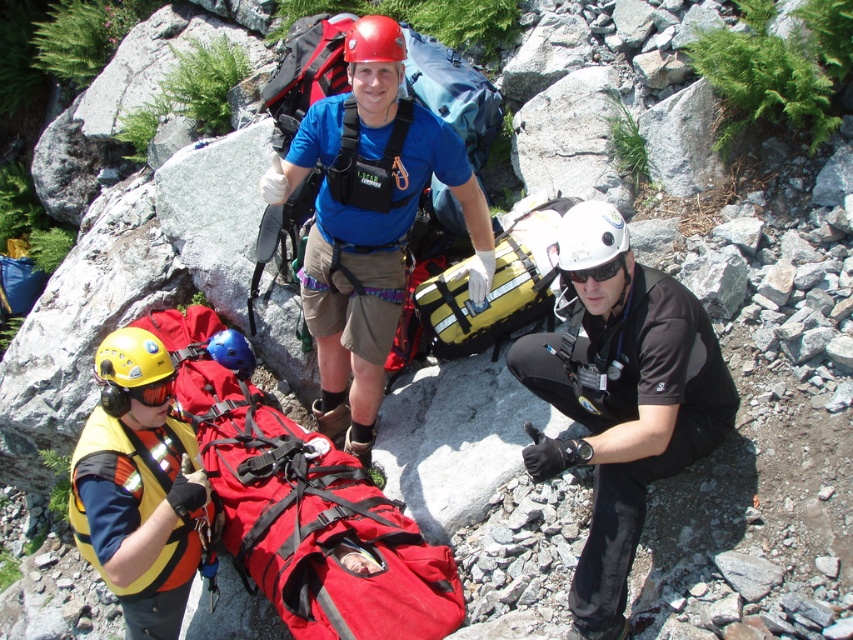
You are part of the rescue team and need to locate the yellow fabric backpack at center quickly. Based on the coordinates provided, where would you direct your team to find it?

The yellow fabric backpack at center is located at point (494, 289), so direct your team to that coordinate for its exact position.

You are part of a rescue team and need to locate the yellow matte helmet at lower left and the blue matte helmet at center. Based on the scene description, which helmet is positioned lower in the image?

The yellow matte helmet at lower left is positioned lower than the blue matte helmet at center in the image.